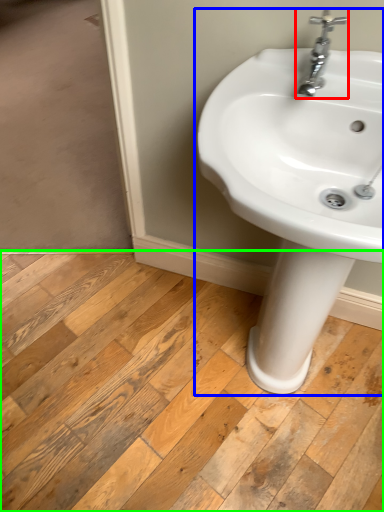
Question: Based on their relative distances, which object is farther from tap (highlighted by a red box)? Choose from sink (highlighted by a blue box) and plank (highlighted by a green box).

Choices:
 (A) sink
 (B) plank

Answer: (B)